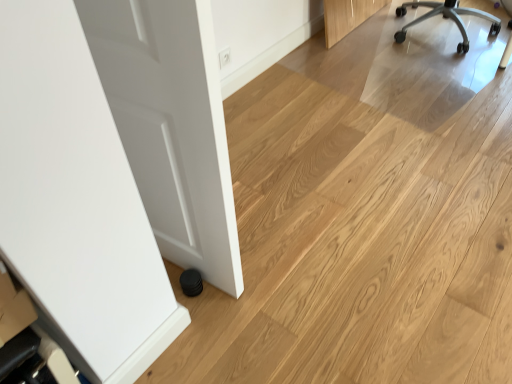
Where is `free space in front of white glossy door at left`? free space in front of white glossy door at left is located at coordinates (215, 334).